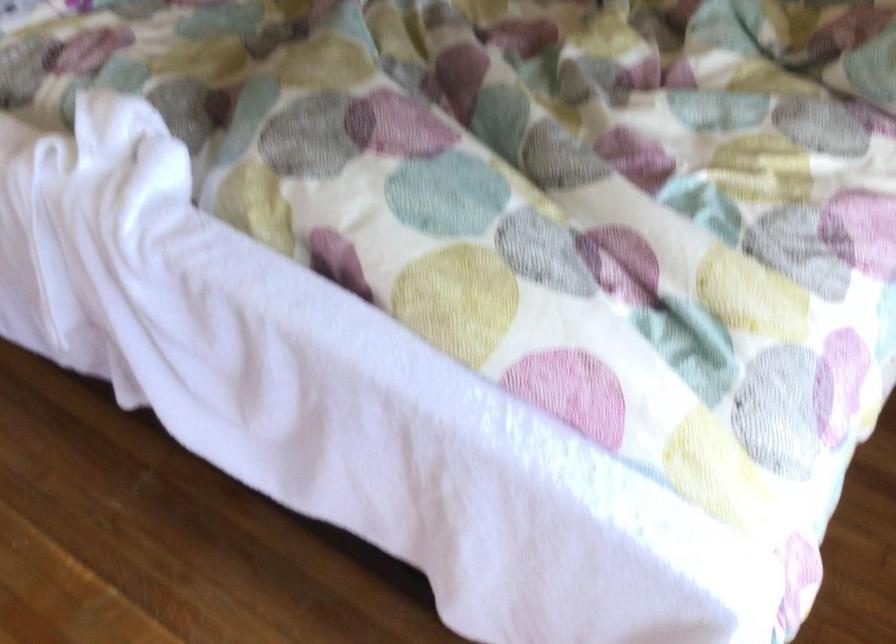
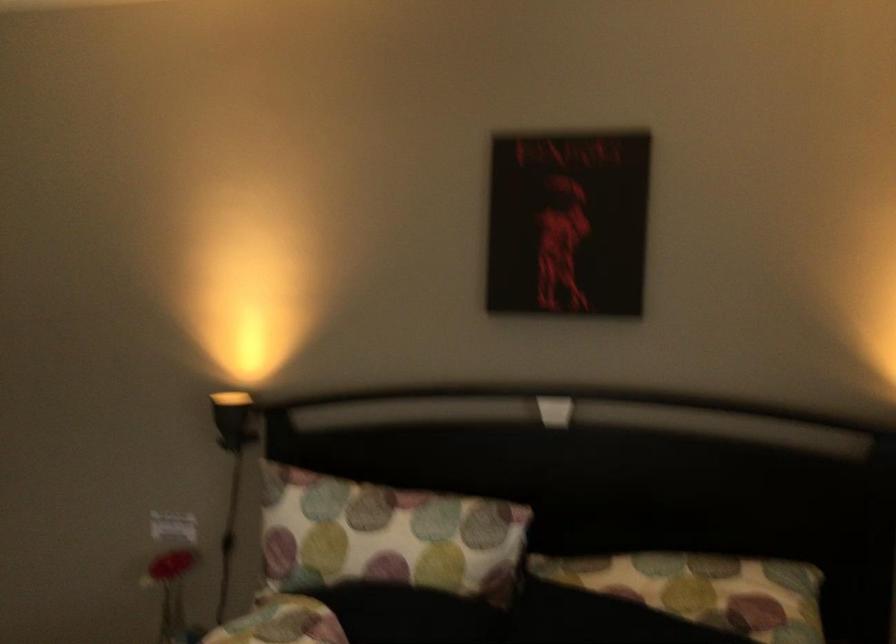
First-person continuous shooting, in which direction is the camera rotating?

The camera rotated toward right-up.